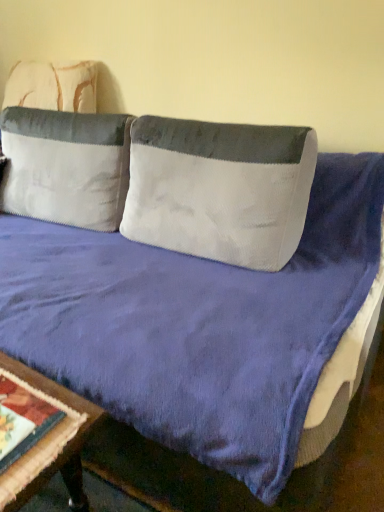
Question: Is white velvety pillow at upper left, which is the 1th pillow from left to right, oriented towards white textured pillow at center, the 2th pillow when ordered from left to right?

Choices:
 (A) yes
 (B) no

Answer: (B)

Question: Is white velvety pillow at upper left, which is the 1th pillow from left to right, closer to camera compared to white textured pillow at center, the 2th pillow when ordered from left to right?

Choices:
 (A) no
 (B) yes

Answer: (A)

Question: Is white velvety pillow at upper left, which ranks as the 2th pillow in right-to-left order, wider than white textured pillow at center, arranged as the 1th pillow when viewed from the right?

Choices:
 (A) yes
 (B) no

Answer: (A)

Question: From the image's perspective, does white velvety pillow at upper left, which is the 1th pillow from left to right, appear lower than white textured pillow at center, the 2th pillow when ordered from left to right?

Choices:
 (A) yes
 (B) no

Answer: (B)

Question: Is white velvety pillow at upper left, which ranks as the 2th pillow in right-to-left order, thinner than white textured pillow at center, arranged as the 1th pillow when viewed from the right?

Choices:
 (A) yes
 (B) no

Answer: (B)

Question: Is point (74, 406) positioned closer to the camera than point (41, 111)?

Choices:
 (A) farther
 (B) closer

Answer: (B)

Question: Is wooden table at lower left bigger or smaller than white velvety pillow at upper left, which ranks as the 2th pillow in right-to-left order?

Choices:
 (A) big
 (B) small

Answer: (B)

Question: In terms of width, does wooden table at lower left look wider or thinner when compared to white velvety pillow at upper left, which is the 1th pillow from left to right?

Choices:
 (A) thin
 (B) wide

Answer: (A)

Question: From the image's perspective, is wooden table at lower left above or below white velvety pillow at upper left, which is the 1th pillow from left to right?

Choices:
 (A) below
 (B) above

Answer: (A)

Question: Visually, is white velvety pillow at upper left, which ranks as the 2th pillow in right-to-left order, positioned to the left or to the right of white textured pillow at center, the 2th pillow when ordered from left to right?

Choices:
 (A) right
 (B) left

Answer: (B)

Question: Is white velvety pillow at upper left, which ranks as the 2th pillow in right-to-left order, spatially inside white textured pillow at center, the 2th pillow when ordered from left to right, or outside of it?

Choices:
 (A) inside
 (B) outside

Answer: (B)

Question: Relative to white textured pillow at center, arranged as the 1th pillow when viewed from the right, is white velvety pillow at upper left, which is the 1th pillow from left to right, in front or behind?

Choices:
 (A) front
 (B) behind

Answer: (B)

Question: In terms of height, does white velvety pillow at upper left, which is the 1th pillow from left to right, look taller or shorter compared to white textured pillow at center, the 2th pillow when ordered from left to right?

Choices:
 (A) short
 (B) tall

Answer: (B)

Question: Is point (135, 227) positioned closer to the camera than point (23, 196)?

Choices:
 (A) closer
 (B) farther

Answer: (A)

Question: Is white textured pillow at center, arranged as the 1th pillow when viewed from the right, taller or shorter than white velvety pillow at upper left, which is the 1th pillow from left to right?

Choices:
 (A) tall
 (B) short

Answer: (B)